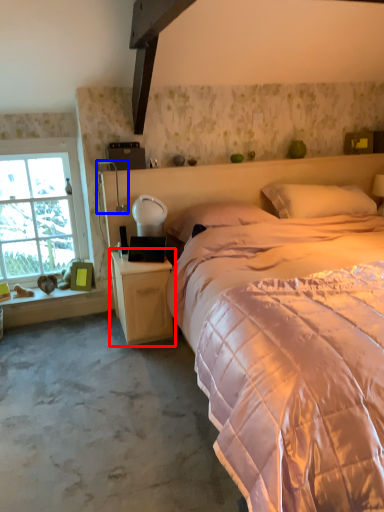
Question: Which of the following is the farthest to the observer, nightstand (highlighted by a red box) or table lamp (highlighted by a blue box)?

Choices:
 (A) nightstand
 (B) table lamp

Answer: (B)